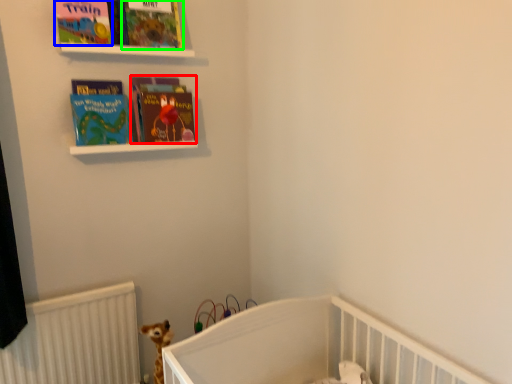
Question: Which object is positioned farthest from book (highlighted by a red box)? Select from book cover (highlighted by a blue box) and book cover (highlighted by a green box).

Choices:
 (A) book cover
 (B) book cover

Answer: (A)